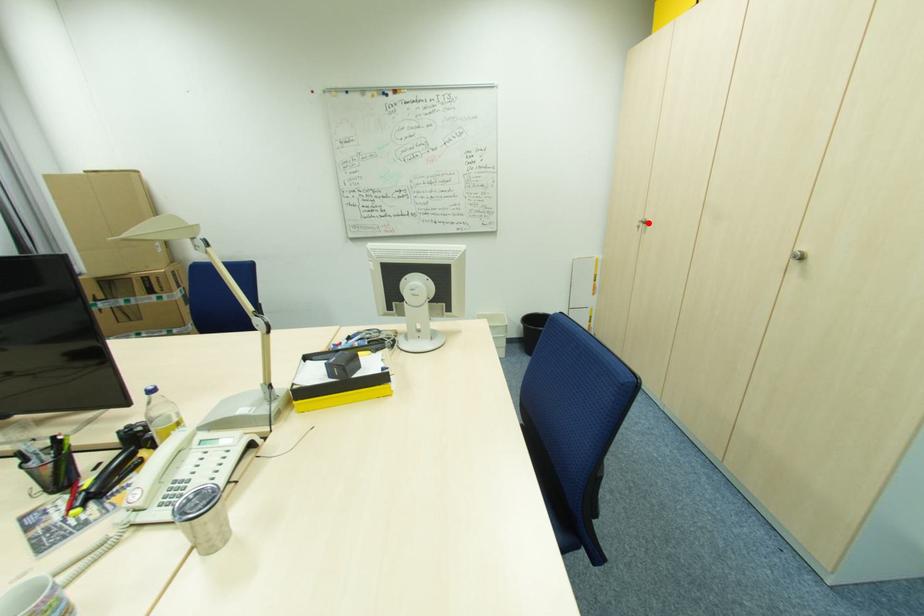
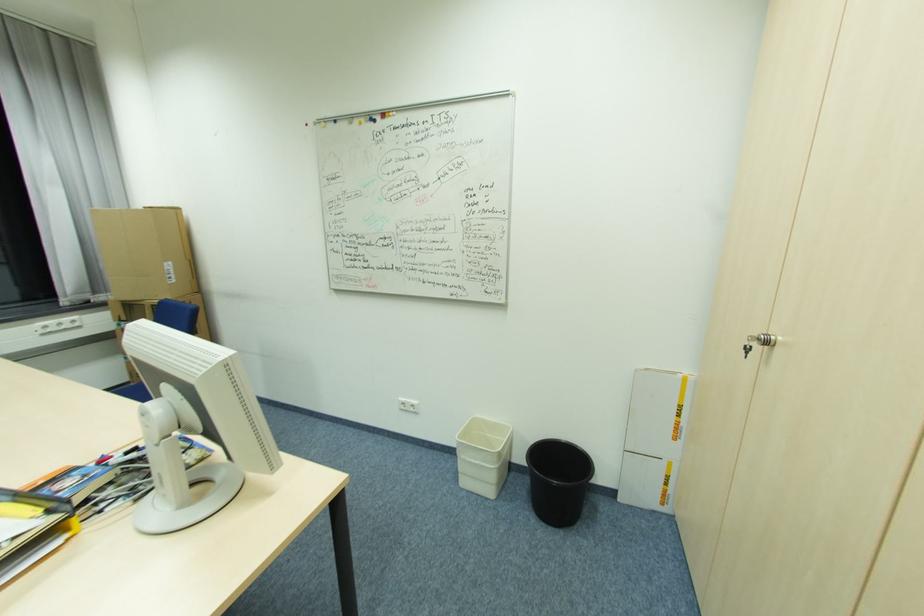
Where in the second image is the point corresponding to the highlighted location from the first image?

(772, 344)